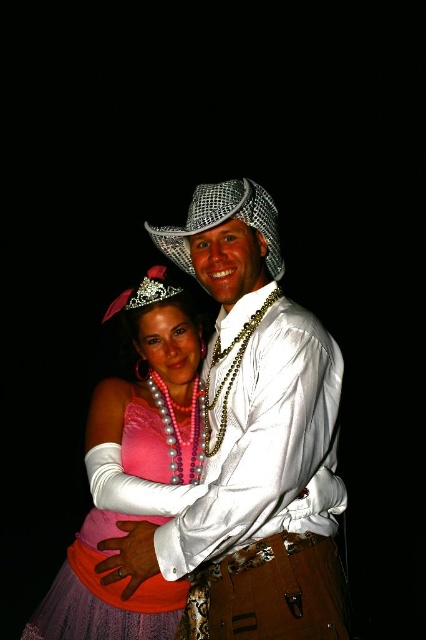
Question: Can you confirm if pink satin dress at center is positioned to the left of glittery metallic cowboy hat at center?

Choices:
 (A) no
 (B) yes

Answer: (B)

Question: Which object is the closest to the satin white shirt at center?

Choices:
 (A) pink satin dress at center
 (B) glittery metallic cowboy hat at center

Answer: (A)

Question: Can you confirm if satin white shirt at center is positioned to the left of glittery metallic cowboy hat at center?

Choices:
 (A) yes
 (B) no

Answer: (A)

Question: Where is satin white shirt at center located in relation to pink satin dress at center in the image?

Choices:
 (A) above
 (B) below

Answer: (A)

Question: Considering the real-world distances, which object is farthest from the satin white shirt at center?

Choices:
 (A) glittery metallic cowboy hat at center
 (B) pink satin dress at center

Answer: (A)

Question: Which point is farther from the camera taking this photo?

Choices:
 (A) (72, 605)
 (B) (275, 205)
 (C) (213, 531)

Answer: (B)